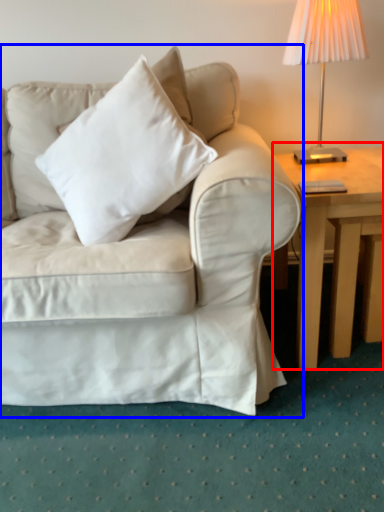
Question: Which object is closer to the camera taking this photo, table (highlighted by a red box) or studio couch (highlighted by a blue box)?

Choices:
 (A) table
 (B) studio couch

Answer: (B)